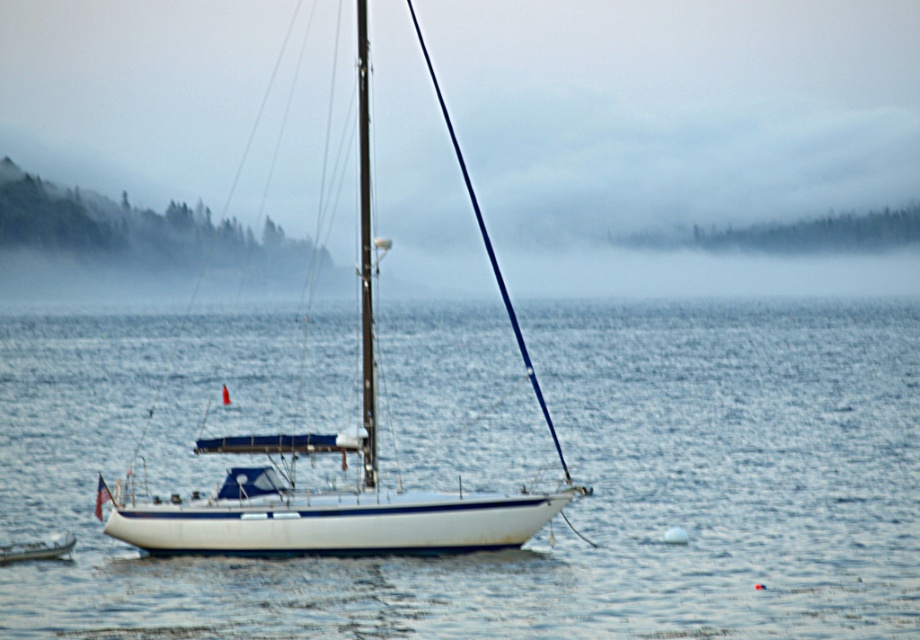
Is white smooth water at center wider than white glossy boat at lower left?

Yes, white smooth water at center is wider than white glossy boat at lower left.

At what (x,y) coordinates should I click in order to perform the action: click on white smooth water at center. Please return your answer as a coordinate pair (x, y). Looking at the image, I should click on (554, 518).

Who is taller, white smooth water at center or white glossy sailboat at center?

With more height is white glossy sailboat at center.

Who is higher up, white smooth water at center or white glossy sailboat at center?

Positioned higher is white glossy sailboat at center.

Does point (614, 531) come behind point (475, 528)?

Yes.

Where is `white smooth water at center`? The height and width of the screenshot is (640, 920). white smooth water at center is located at coordinates (554, 518).

Is white glossy sailboat at center smaller than white glossy boat at lower left?

No, white glossy sailboat at center is not smaller than white glossy boat at lower left.

Is white glossy sailboat at center wider than white glossy boat at lower left?

Yes.

Between point (366, 497) and point (72, 538), which one is positioned in front?

Point (366, 497)

Locate an element on the screen. white glossy sailboat at center is located at coordinates (343, 458).